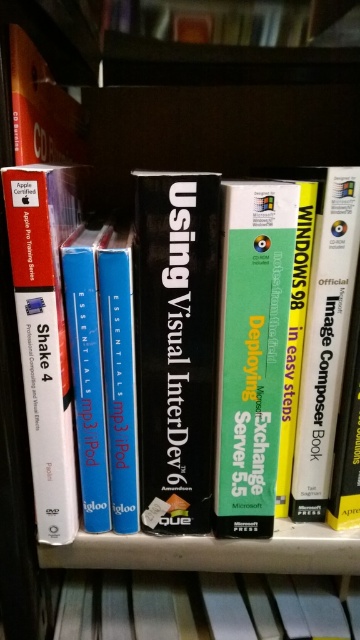
Is point (217, 248) positioned in front of point (234, 608)?

Yes.

Who is more forward, (180, 456) or (140, 608)?

Point (180, 456) is more forward.

Does point (168, 385) come farther from viewer compared to point (132, 572)?

No, (168, 385) is closer to viewer.

At what (x,y) coordinates should I click in order to perform the action: click on black paper at center. Please return your answer as a coordinate pair (x, y). The height and width of the screenshot is (640, 360). Looking at the image, I should click on (176, 344).

Who is positioned more to the right, matte white book at left or blue paper at center?

blue paper at center is more to the right.

Can you confirm if matte white book at left is wider than blue paper at center?

Indeed, matte white book at left has a greater width compared to blue paper at center.

The image size is (360, 640). I want to click on matte white book at left, so click(x=45, y=333).

Does black matte book at center come in front of blue paper at center?

No, it is behind blue paper at center.

At what (x,y) coordinates should I click in order to perform the action: click on black matte book at center. Please return your answer as a coordinate pair (x, y). The width and height of the screenshot is (360, 640). Looking at the image, I should click on (204, 605).